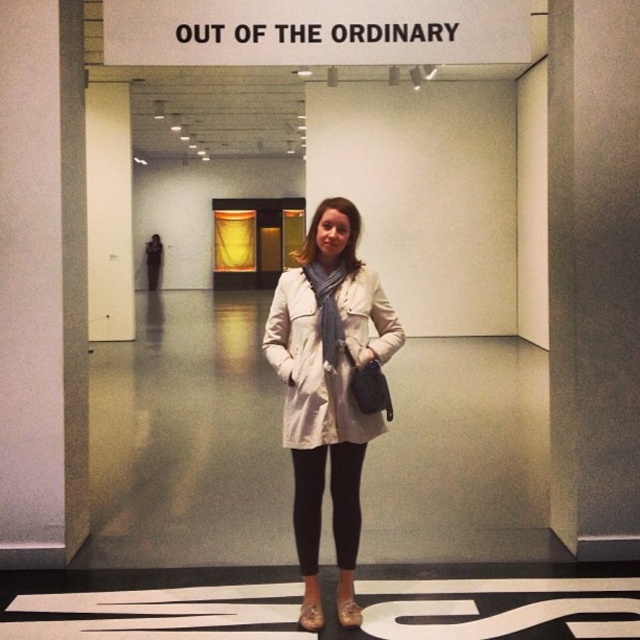
Is matte white coat at center above black leggings at center?

Correct, matte white coat at center is located above black leggings at center.

In the scene shown: Between matte white coat at center and black leggings at center, which one has less height?

black leggings at center

Find the location of a particular element. The width and height of the screenshot is (640, 640). matte white coat at center is located at coordinates (326, 356).

Where is `matte white coat at center`? The width and height of the screenshot is (640, 640). matte white coat at center is located at coordinates (326, 356).

Who is taller, beige fabric coat at center or black leggings at center?

Standing taller between the two is beige fabric coat at center.

Does beige fabric coat at center appear on the left side of black leggings at center?

Incorrect, beige fabric coat at center is not on the left side of black leggings at center.

The image size is (640, 640). I want to click on beige fabric coat at center, so click(x=326, y=388).

Does point (356, 321) come farther from viewer compared to point (298, 432)?

No, it is in front of (298, 432).

Between beige fabric coat at center and matte white coat at center, which one appears on the right side from the viewer's perspective?

From the viewer's perspective, beige fabric coat at center appears more on the right side.

At what (x,y) coordinates should I click in order to perform the action: click on beige fabric coat at center. Please return your answer as a coordinate pair (x, y). Looking at the image, I should click on (326, 388).